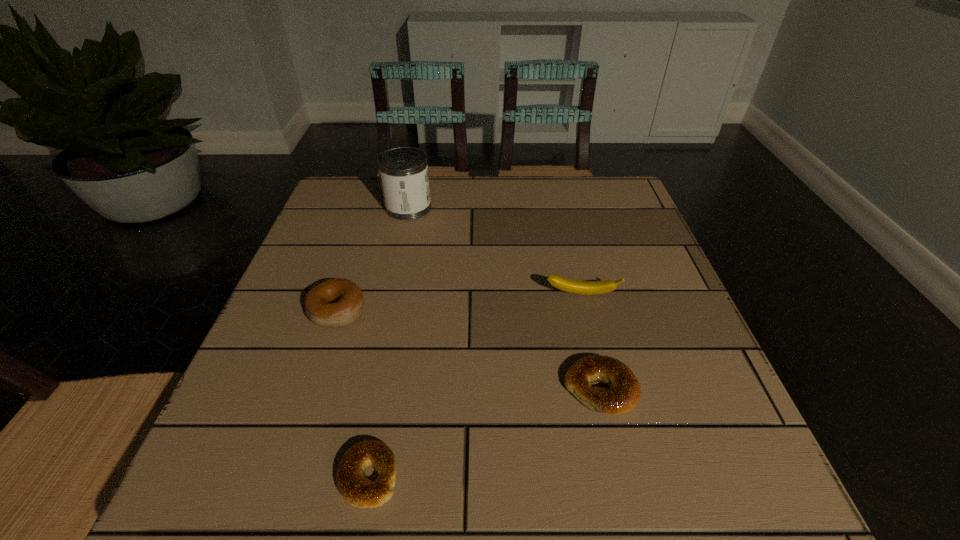
At what (x,y) coordinates should I click in order to perform the action: click on object that is positioned at the far left corner. Please return your answer as a coordinate pair (x, y). Looking at the image, I should click on (403, 171).

In the image, there is a desktop. Where is `vacant space at the far edge`? The width and height of the screenshot is (960, 540). vacant space at the far edge is located at coordinates pos(544,208).

You are a GUI agent. You are given a task and a screenshot of the screen. Output one action in this format:
    pyautogui.click(x=<x>, y=<y>)
    Task: Click on the vacant space at the near edge of the desktop
    This screenshot has height=540, width=960.
    Given the screenshot: What is the action you would take?
    pyautogui.click(x=490, y=517)

Where is `free space at the left edge`? This screenshot has height=540, width=960. free space at the left edge is located at coordinates (316, 243).

In the image, there is a desktop. In order to click on free region at the right edge in this screenshot , I will do `click(681, 329)`.

I want to click on free space at the far left corner of the desktop, so click(352, 211).

The width and height of the screenshot is (960, 540). What are the coordinates of `vacant point at the far right corner` in the screenshot? It's located at (603, 204).

This screenshot has width=960, height=540. I want to click on blank space at the near right corner of the desktop, so click(x=726, y=516).

I want to click on free space between the shortest object and the tallest bagel, so click(x=352, y=394).

The image size is (960, 540). Find the location of `unoccupied position between the tallest object and the tallest bagel`. unoccupied position between the tallest object and the tallest bagel is located at coordinates (372, 260).